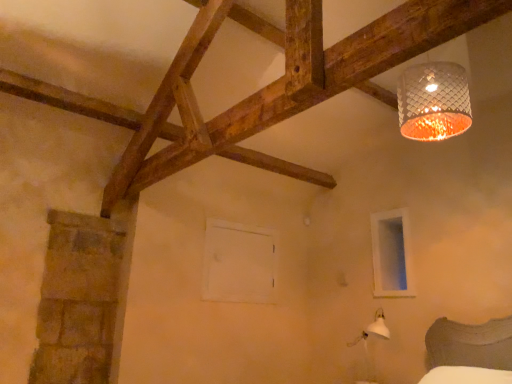
The image size is (512, 384). I want to click on white matte window frame at lower right, which appears as the 1th window frame when viewed from the right, so click(391, 254).

Describe the element at coordinates (391, 254) in the screenshot. I see `white matte window frame at lower right, which is the second window frame from left to right` at that location.

You are a GUI agent. You are given a task and a screenshot of the screen. Output one action in this format:
    pyautogui.click(x=<x>, y=<y>)
    Task: Click on the white matte window frame at center, the second window frame from the right
    The height and width of the screenshot is (384, 512).
    Given the screenshot: What is the action you would take?
    pyautogui.click(x=238, y=263)

Looking at this image, what is the approximate height of white matte window frame at center, the second window frame from the right?

The height of white matte window frame at center, the second window frame from the right, is 71.79 centimeters.

Image resolution: width=512 pixels, height=384 pixels. What do you see at coordinates (238, 263) in the screenshot?
I see `white matte window frame at center, which ranks as the 1th window frame in left-to-right order` at bounding box center [238, 263].

Locate an element on the screen. This screenshot has height=384, width=512. white matte window frame at lower right, which is the second window frame from left to right is located at coordinates (391, 254).

Considering the positions of objects white matte window frame at lower right, which is the second window frame from left to right, and white matte window frame at center, the second window frame from the right, in the image provided, who is more to the left, white matte window frame at lower right, which is the second window frame from left to right, or white matte window frame at center, the second window frame from the right,?

From the viewer's perspective, white matte window frame at center, the second window frame from the right, appears more on the left side.

Consider the image. Which object is further away from the camera taking this photo, white matte window frame at lower right, which appears as the 1th window frame when viewed from the right, or white matte window frame at center, which ranks as the 1th window frame in left-to-right order?

white matte window frame at center, which ranks as the 1th window frame in left-to-right order, is more distant.

Which is in front, point (394, 275) or point (254, 259)?

The point (394, 275) is closer.

From the image's perspective, which one is positioned higher, white matte window frame at lower right, which appears as the 1th window frame when viewed from the right, or white matte window frame at center, which ranks as the 1th window frame in left-to-right order?

white matte window frame at lower right, which appears as the 1th window frame when viewed from the right, is shown above in the image.

From a real-world perspective, is white matte window frame at lower right, which is the second window frame from left to right, physically located above or below white matte window frame at center, the second window frame from the right?

Clearly, from a real-world perspective, white matte window frame at lower right, which is the second window frame from left to right, is above white matte window frame at center, the second window frame from the right.

From the picture: Which object is wider, white matte window frame at lower right, which appears as the 1th window frame when viewed from the right, or white matte window frame at center, which ranks as the 1th window frame in left-to-right order?

white matte window frame at center, which ranks as the 1th window frame in left-to-right order.

Considering the sizes of white matte window frame at lower right, which appears as the 1th window frame when viewed from the right, and white matte window frame at center, the second window frame from the right, in the image, is white matte window frame at lower right, which appears as the 1th window frame when viewed from the right, taller or shorter than white matte window frame at center, the second window frame from the right,?

Clearly, white matte window frame at lower right, which appears as the 1th window frame when viewed from the right, is taller compared to white matte window frame at center, the second window frame from the right.

Is white matte window frame at lower right, which appears as the 1th window frame when viewed from the right, smaller than white matte window frame at center, which ranks as the 1th window frame in left-to-right order?

Indeed, white matte window frame at lower right, which appears as the 1th window frame when viewed from the right, has a smaller size compared to white matte window frame at center, which ranks as the 1th window frame in left-to-right order.

Is white matte window frame at lower right, which appears as the 1th window frame when viewed from the right, positioned beyond the bounds of white matte window frame at center, the second window frame from the right?

Yes.

Would you say white matte window frame at lower right, which appears as the 1th window frame when viewed from the right, is a long distance from white matte window frame at center, which ranks as the 1th window frame in left-to-right order?

Yes, white matte window frame at lower right, which appears as the 1th window frame when viewed from the right, is far from white matte window frame at center, which ranks as the 1th window frame in left-to-right order.

Is white matte window frame at lower right, which appears as the 1th window frame when viewed from the right, oriented towards white matte window frame at center, the second window frame from the right?

No.

How different are the orientations of white matte window frame at lower right, which appears as the 1th window frame when viewed from the right, and white matte window frame at center, which ranks as the 1th window frame in left-to-right order, in degrees?

The angle between the facing direction of white matte window frame at lower right, which appears as the 1th window frame when viewed from the right, and the facing direction of white matte window frame at center, which ranks as the 1th window frame in left-to-right order, is 88.6 degrees.

At what (x,y) coordinates should I click in order to perform the action: click on window frame located in front of the white matte window frame at center, which ranks as the 1th window frame in left-to-right order. Please return your answer as a coordinate pair (x, y). Looking at the image, I should click on (391, 254).

Does white matte window frame at center, the second window frame from the right, appear on the left side of white matte window frame at lower right, which is the second window frame from left to right?

Yes, white matte window frame at center, the second window frame from the right, is to the left of white matte window frame at lower right, which is the second window frame from left to right.

In the image, is white matte window frame at center, the second window frame from the right, positioned in front of or behind white matte window frame at lower right, which is the second window frame from left to right?

In the image, white matte window frame at center, the second window frame from the right, appears behind white matte window frame at lower right, which is the second window frame from left to right.

Which is further, (228, 255) or (380, 270)?

The point (228, 255) is behind.

From the image's perspective, which is below, white matte window frame at center, which ranks as the 1th window frame in left-to-right order, or white matte window frame at lower right, which is the second window frame from left to right?

white matte window frame at center, which ranks as the 1th window frame in left-to-right order.

From a real-world perspective, which is physically above, white matte window frame at center, which ranks as the 1th window frame in left-to-right order, or white matte window frame at lower right, which is the second window frame from left to right?

From a 3D spatial view, white matte window frame at lower right, which is the second window frame from left to right, is above.

Does white matte window frame at center, which ranks as the 1th window frame in left-to-right order, have a greater width compared to white matte window frame at lower right, which is the second window frame from left to right?

Yes, white matte window frame at center, which ranks as the 1th window frame in left-to-right order, is wider than white matte window frame at lower right, which is the second window frame from left to right.

Considering the relative sizes of white matte window frame at center, the second window frame from the right, and white matte window frame at lower right, which appears as the 1th window frame when viewed from the right, in the image provided, is white matte window frame at center, the second window frame from the right, taller than white matte window frame at lower right, which appears as the 1th window frame when viewed from the right,?

No.

Is white matte window frame at center, which ranks as the 1th window frame in left-to-right order, bigger or smaller than white matte window frame at lower right, which appears as the 1th window frame when viewed from the right?

Clearly, white matte window frame at center, which ranks as the 1th window frame in left-to-right order, is larger in size than white matte window frame at lower right, which appears as the 1th window frame when viewed from the right.

Is white matte window frame at lower right, which is the second window frame from left to right, surrounded by white matte window frame at center, which ranks as the 1th window frame in left-to-right order?

No, white matte window frame at lower right, which is the second window frame from left to right, is located outside of white matte window frame at center, which ranks as the 1th window frame in left-to-right order.

Is white matte window frame at center, which ranks as the 1th window frame in left-to-right order, directly adjacent to white matte window frame at lower right, which appears as the 1th window frame when viewed from the right?

white matte window frame at center, which ranks as the 1th window frame in left-to-right order, and white matte window frame at lower right, which appears as the 1th window frame when viewed from the right, are not in contact.

Could you tell me if white matte window frame at center, which ranks as the 1th window frame in left-to-right order, is turned towards white matte window frame at lower right, which appears as the 1th window frame when viewed from the right?

Yes, white matte window frame at center, which ranks as the 1th window frame in left-to-right order, is facing white matte window frame at lower right, which appears as the 1th window frame when viewed from the right.

How different are the orientations of white matte window frame at center, which ranks as the 1th window frame in left-to-right order, and white matte window frame at lower right, which is the second window frame from left to right, in degrees?

The angular difference between white matte window frame at center, which ranks as the 1th window frame in left-to-right order, and white matte window frame at lower right, which is the second window frame from left to right, is 88.6 degrees.

How far apart are white matte window frame at center, the second window frame from the right, and white matte window frame at lower right, which is the second window frame from left to right?

1.14 meters.

The image size is (512, 384). I want to click on window frame that appears in front of the white matte window frame at center, which ranks as the 1th window frame in left-to-right order, so click(391, 254).

Locate an element on the screen. The image size is (512, 384). window frame below the white matte window frame at lower right, which is the second window frame from left to right (from a real-world perspective) is located at coordinates (238, 263).

The width and height of the screenshot is (512, 384). I want to click on window frame lying behind the white matte window frame at lower right, which appears as the 1th window frame when viewed from the right, so click(x=238, y=263).